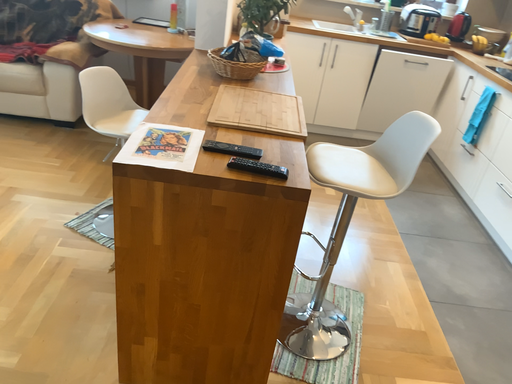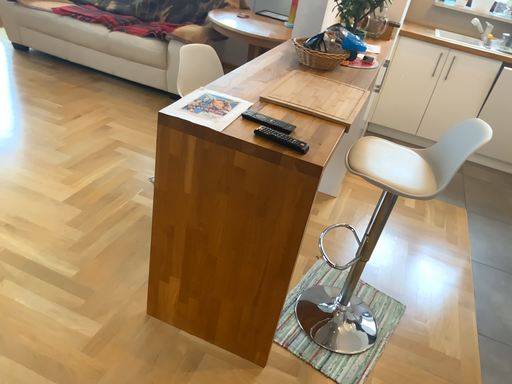
Question: Which way did the camera rotate in the video?

Choices:
 (A) rotated left
 (B) rotated right

Answer: (A)